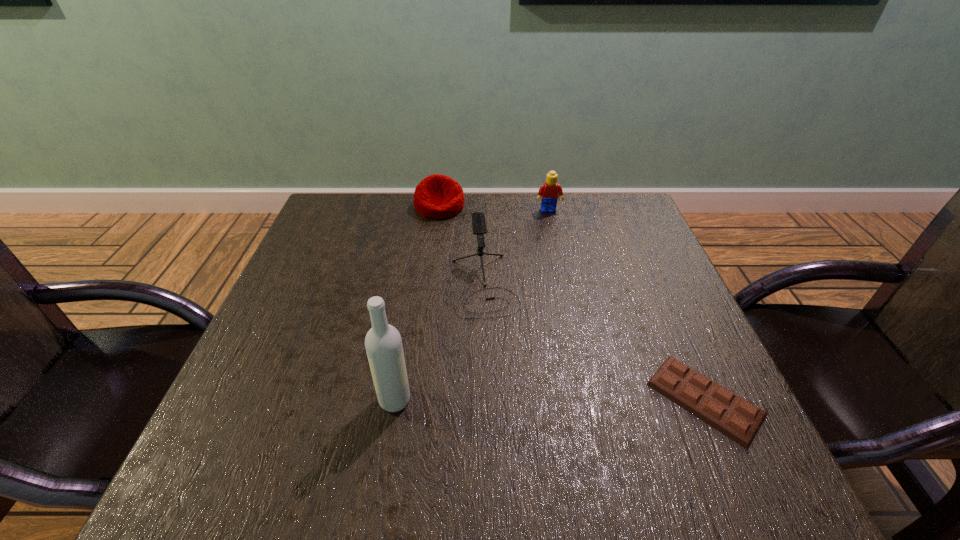
At what (x,y) coordinates should I click in order to perform the action: click on free spot between the chocolate bar and the fourth tallest object. Please return your answer as a coordinate pair (x, y). Looking at the image, I should click on (572, 302).

Where is `free spot between the microphone and the chocolate bar`? free spot between the microphone and the chocolate bar is located at coordinates (595, 342).

Identify the location of free point between the third farthest object and the shortest object. This screenshot has width=960, height=540. (595, 342).

Find the location of a particular element. The width and height of the screenshot is (960, 540). free space between the microphone and the Lego is located at coordinates (516, 248).

Identify the location of vacant space that's between the second shortest object and the vodka. (418, 303).

Locate an element on the screen. vacant point located between the chocolate bar and the vodka is located at coordinates (550, 399).

At what (x,y) coordinates should I click in order to perform the action: click on free space between the vodka and the third nearest object. Please return your answer as a coordinate pair (x, y). Looking at the image, I should click on pyautogui.click(x=440, y=342).

I want to click on free space between the fourth object from left to right and the beanbag, so click(493, 208).

Identify which object is the second nearest to the vodka. Please provide its 2D coordinates. Your answer should be formatted as a tuple, i.e. [(x, y)], where the tuple contains the x and y coordinates of a point satisfying the conditions above.

[(730, 414)]

Locate an element on the screen. object that stands as the fourth closest to the Lego is located at coordinates (383, 343).